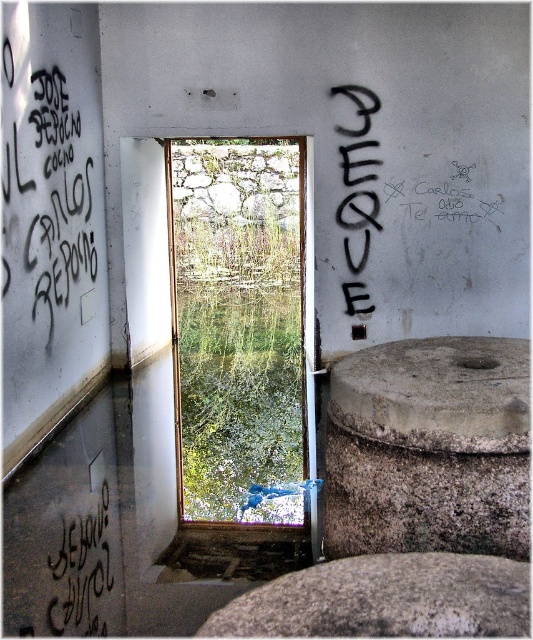
Question: Which of the following is the closest to the observer?

Choices:
 (A) (292, 310)
 (B) (351, 260)
 (C) (54, 609)

Answer: (C)

Question: Can you confirm if gray rough stone at lower right is positioned below black graffiti at lower left?

Choices:
 (A) yes
 (B) no

Answer: (B)

Question: Which of the following is the closest to the observer?

Choices:
 (A) (286, 497)
 (B) (302, 628)
 (C) (96, 580)
 (D) (357, 138)

Answer: (B)

Question: Considering the relative positions of black graffiti at lower left and black graffiti at upper right in the image provided, where is black graffiti at lower left located with respect to black graffiti at upper right?

Choices:
 (A) below
 (B) above

Answer: (A)

Question: Which object is closer to the camera taking this photo?

Choices:
 (A) gray rough stone at lower right
 (B) black graffiti at lower left
 (C) black graffiti at upper right
 (D) wooden frame at center

Answer: (A)

Question: Is black graffiti at lower left bigger than black graffiti at upper right?

Choices:
 (A) no
 (B) yes

Answer: (A)